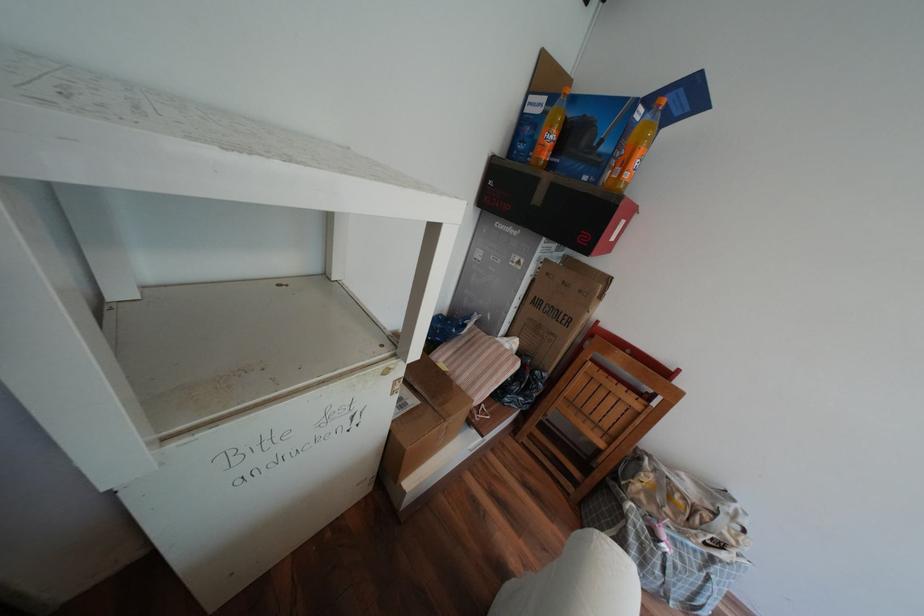
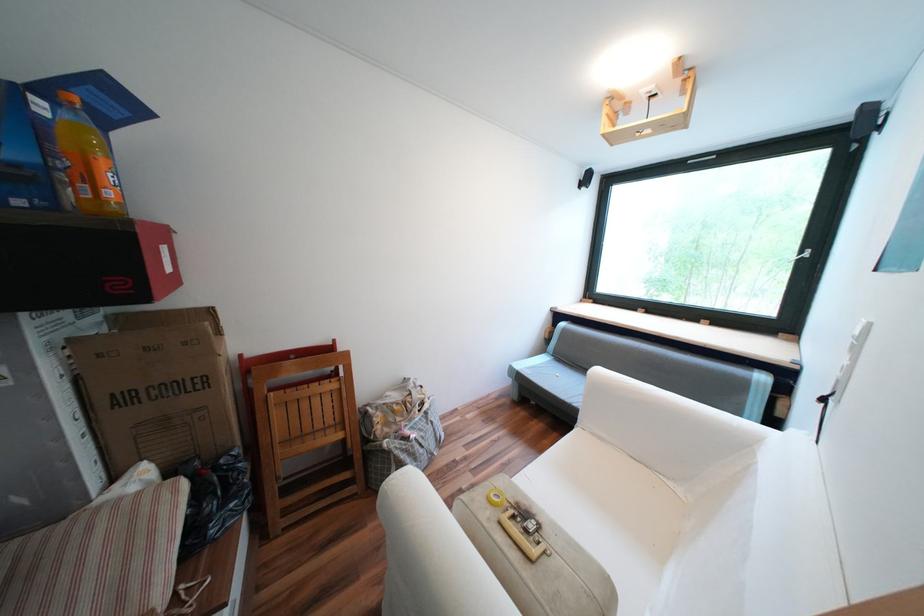
How did the camera likely rotate?

The rotation direction of the camera is right-down.